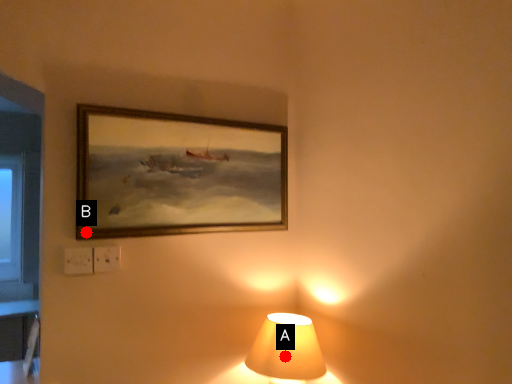
Question: Two points are circled on the image, labeled by A and B beside each circle. Which point appears closest to the camera in this image?

Choices:
 (A) A is closer
 (B) B is closer

Answer: (B)